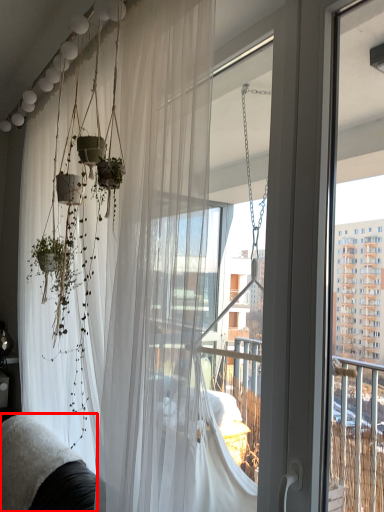
Question: From the image, what is the correct spatial relationship of couch (annotated by the red box) in relation to curtain?

Choices:
 (A) right
 (B) left

Answer: (B)